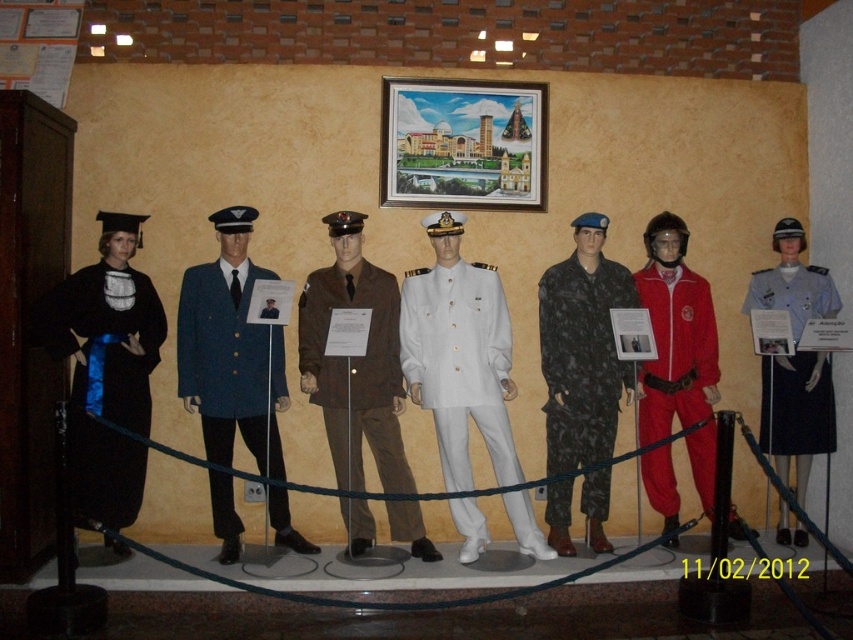
Which mannequin is wearing the blue woolen coat at center?

The blue woolen coat at center is worn by the mannequin positioned at point [227,358].

You are a visitor at the exhibition and want to take a photo of both the matte red jumpsuit at center and the white fabric uniform at center. Which one should you focus on first to ensure it appears larger in your photo?

The matte red jumpsuit at center is much taller than the white fabric uniform at center, so focusing on it first will ensure it appears larger in the photo.